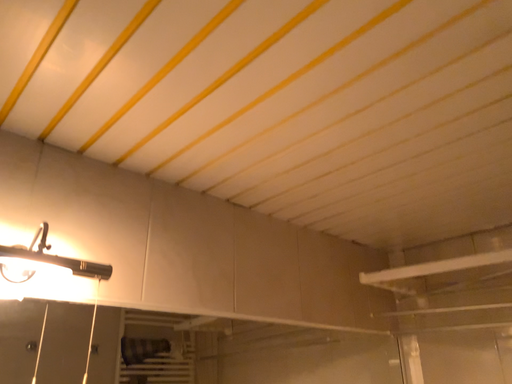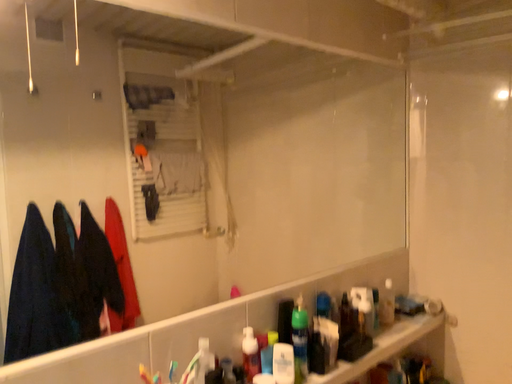
Question: Which way did the camera rotate in the video?

Choices:
 (A) rotated upward
 (B) rotated downward

Answer: (B)